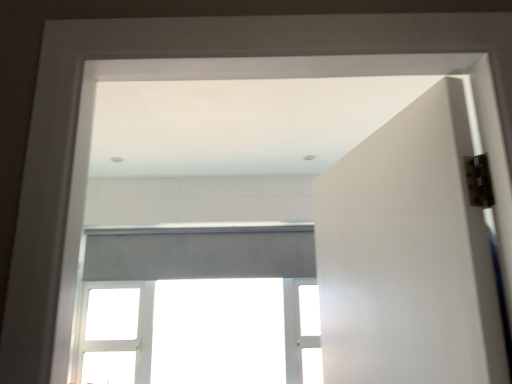
This screenshot has width=512, height=384. What do you see at coordinates (408, 255) in the screenshot?
I see `white matte door at right` at bounding box center [408, 255].

The image size is (512, 384). In order to click on white matte door at right in this screenshot , I will do `click(408, 255)`.

What is the approximate height of white matte window at center?

3.79 feet.

The width and height of the screenshot is (512, 384). Describe the element at coordinates (199, 252) in the screenshot. I see `white matte window at center` at that location.

The image size is (512, 384). Identify the location of white matte window at center. (199, 252).

I want to click on white matte door at right, so click(408, 255).

In the image, is white matte door at right on the left side or the right side of white matte window at center?

white matte door at right is to the right of white matte window at center.

Relative to white matte window at center, is white matte door at right in front or behind?

Visually, white matte door at right is located in front of white matte window at center.

Between point (358, 199) and point (170, 273), which one is positioned in front?

Point (358, 199)

From the image's perspective, is white matte door at right above or below white matte window at center?

Based on their image positions, white matte door at right is located above white matte window at center.

From a real-world perspective, between white matte door at right and white matte window at center, who is vertically higher?

From a 3D spatial view, white matte door at right is above.

Is white matte door at right thinner than white matte window at center?

In fact, white matte door at right might be wider than white matte window at center.

Considering the sizes of white matte door at right and white matte window at center in the image, is white matte door at right taller or shorter than white matte window at center?

Clearly, white matte door at right is shorter compared to white matte window at center.

Which of these two, white matte door at right or white matte window at center, is smaller?

white matte door at right.

Is white matte door at right inside or outside of white matte window at center?

white matte door at right is located beyond the bounds of white matte window at center.

Are white matte door at right and white matte window at center making contact?

white matte door at right and white matte window at center are clearly separated.

Is white matte door at right facing towards white matte window at center?

No.

Find the location of a particular element. Image resolution: width=512 pixels, height=384 pixels. window behind the white matte door at right is located at coordinates (199, 252).

Is white matte window at center to the left of white matte door at right from the viewer's perspective?

Indeed, white matte window at center is positioned on the left side of white matte door at right.

Relative to white matte door at right, is white matte window at center in front or behind?

white matte window at center is behind white matte door at right.

Between point (190, 237) and point (365, 178), which one is positioned behind?

The point (190, 237) is farther.

From the image's perspective, between white matte window at center and white matte door at right, which one is located above?

white matte door at right is shown above in the image.

From a real-world perspective, who is located higher, white matte window at center or white matte door at right?

white matte door at right is physically above.

Considering the sizes of white matte window at center and white matte door at right in the image, is white matte window at center wider or thinner than white matte door at right?

Considering their sizes, white matte window at center looks slimmer than white matte door at right.

Considering the relative sizes of white matte window at center and white matte door at right in the image provided, is white matte window at center taller than white matte door at right?

Yes, white matte window at center is taller than white matte door at right.

Is white matte window at center bigger than white matte door at right?

Yes, white matte window at center is bigger than white matte door at right.

Which is correct: white matte window at center is inside white matte door at right, or outside of it?

white matte window at center exists outside the volume of white matte door at right.

Would you consider white matte window at center to be distant from white matte door at right?

white matte window at center is far away from white matte door at right.

Is white matte window at center oriented towards white matte door at right?

Yes, white matte window at center is turned towards white matte door at right.

What are the coordinates of `door on the right of white matte window at center` in the screenshot? It's located at (x=408, y=255).

I want to click on window directly beneath the white matte door at right (from a real-world perspective), so click(199, 252).

Where is `door above the white matte window at center (from the image's perspective)`? door above the white matte window at center (from the image's perspective) is located at coordinates (408, 255).